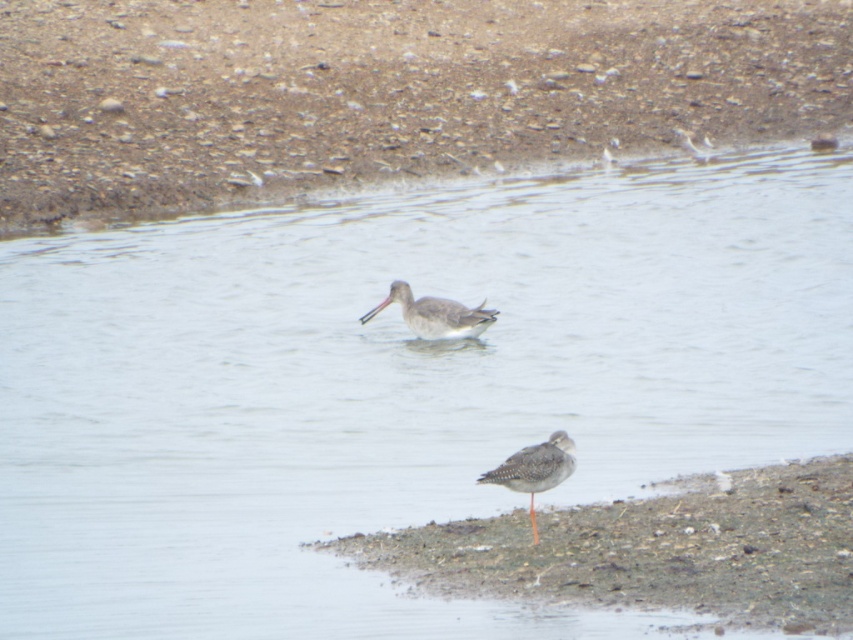
Question: Does brown gravelly sand at upper center have a smaller size compared to brown sandy mud at lower right?

Choices:
 (A) no
 (B) yes

Answer: (B)

Question: Can you confirm if brown gravelly sand at upper center is positioned below speckled gray bird at lower right?

Choices:
 (A) yes
 (B) no

Answer: (B)

Question: Which point is closer to the camera?

Choices:
 (A) brown sandy mud at lower right
 (B) brown gravelly sand at upper center
 (C) speckled gray bird at lower right
 (D) gray matte bird at center

Answer: (A)

Question: Is brown gravelly sand at upper center smaller than brown sandy mud at lower right?

Choices:
 (A) no
 (B) yes

Answer: (B)

Question: Which object is closer to the camera taking this photo?

Choices:
 (A) speckled gray bird at lower right
 (B) brown gravelly sand at upper center

Answer: (A)

Question: Which point appears farthest from the camera in this image?

Choices:
 (A) (537, 492)
 (B) (426, 328)
 (C) (753, 493)
 (D) (119, 186)

Answer: (D)